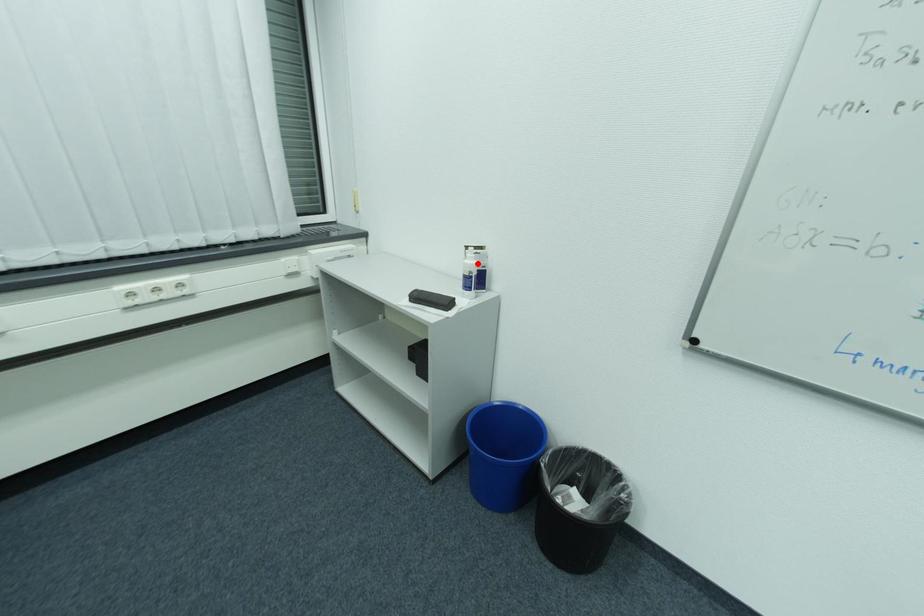
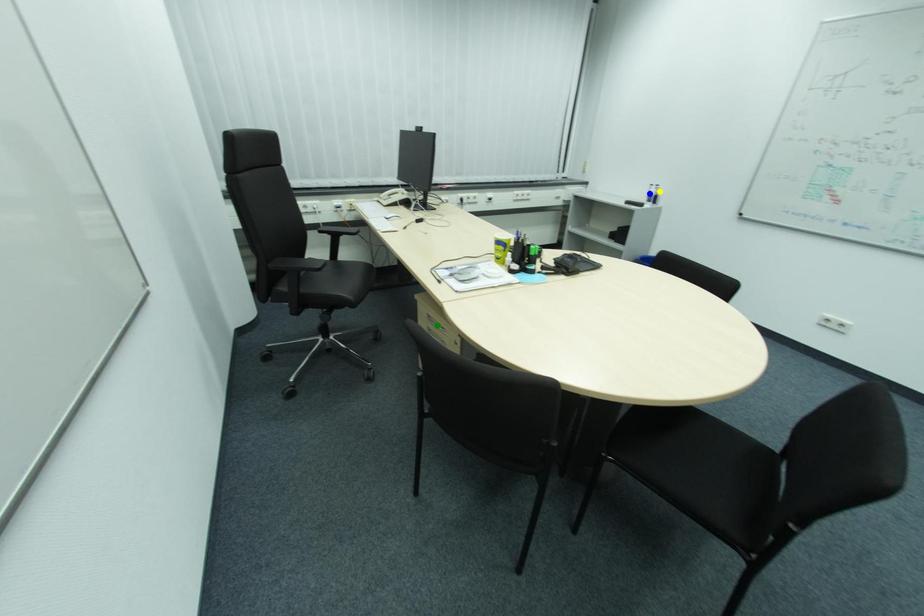
Question: I am providing you with two images of the same scene from different viewpoints. A red point is marked on the first image. You are given multiple points on the second image. In image 2, which mark is for the same physical point as the one in image 1?

Choices:
 (A) blue point
 (B) yellow point
 (C) green point

Answer: (B)